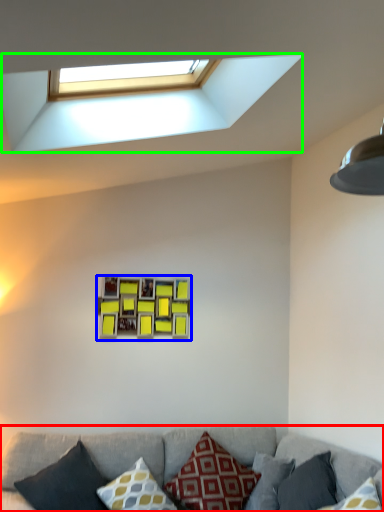
Question: Considering the real-world distances, which object is farthest from studio couch (highlighted by a red box)? picture frame (highlighted by a blue box) or window (highlighted by a green box)?

Choices:
 (A) picture frame
 (B) window

Answer: (B)